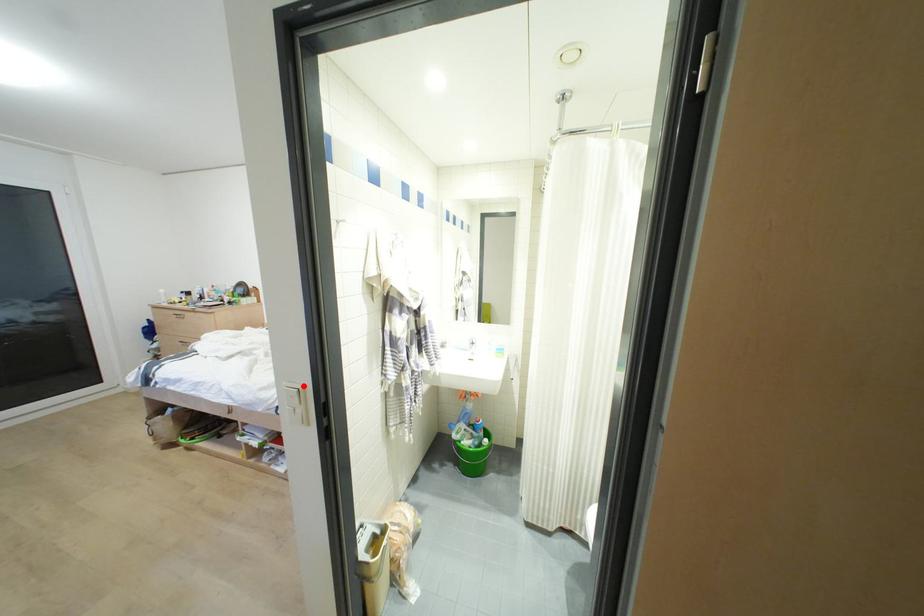
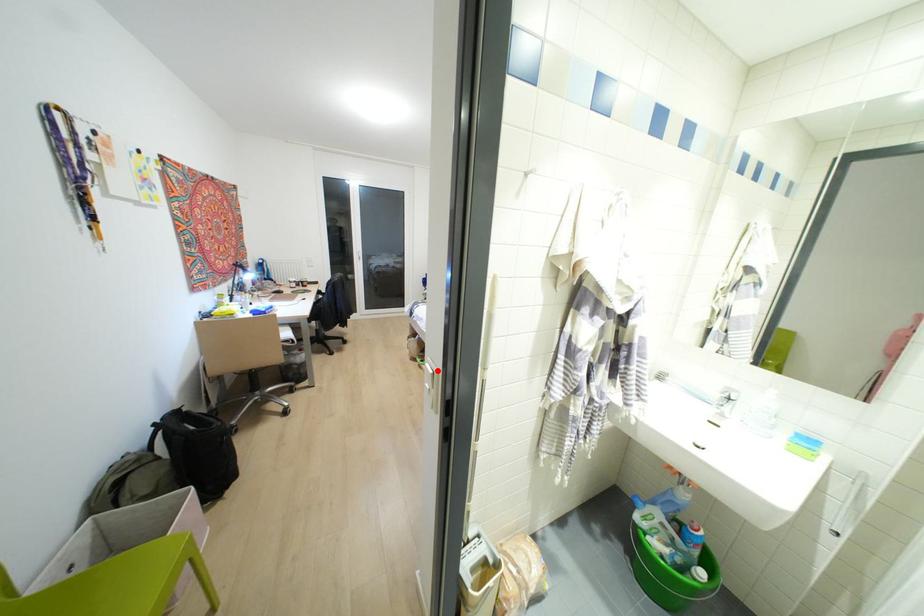
I am providing you with two images of the same scene from different viewpoints. A red point is marked on the first image and another point is marked on the second image. Are the points marked in image1 and image2 representing the same 3D position?

Yes